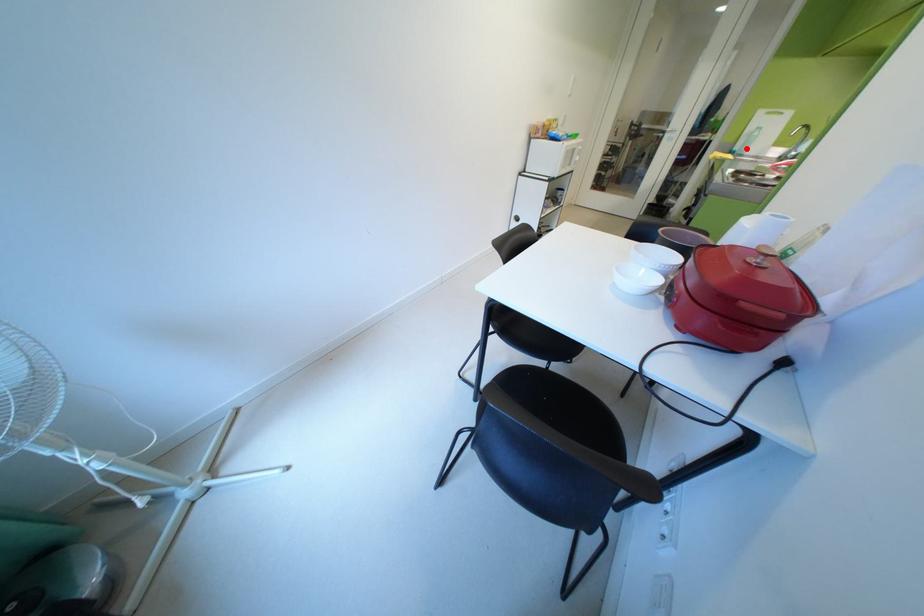
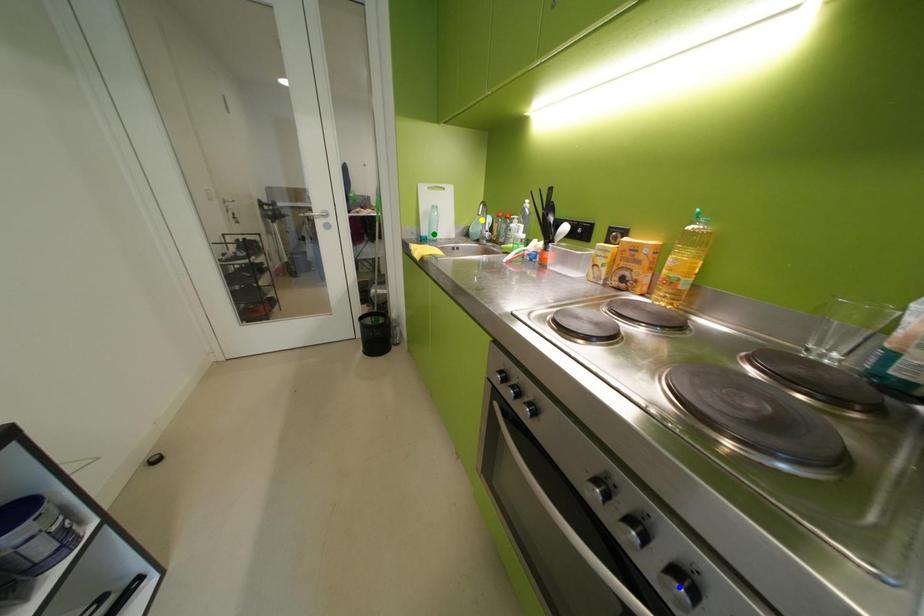
Question: I am providing you with two images of the same scene from different viewpoints. A red point is marked on the first image. You are given multiple points on the second image. Which point in image 2 represents the same 3d spot as the red point in image 1?

Choices:
 (A) green point
 (B) yellow point
 (C) blue point

Answer: (A)